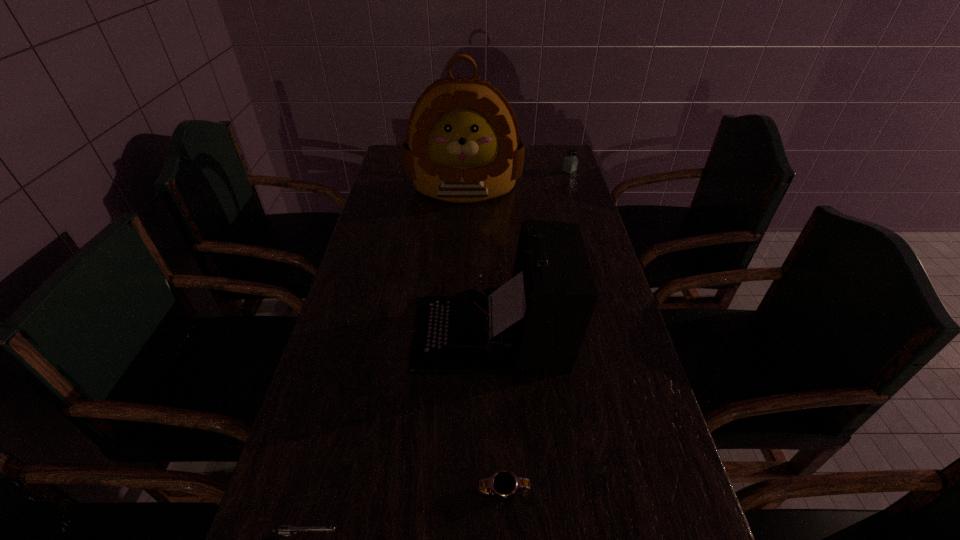
In the image, there is a desktop. Identify the location of free region at the right edge. This screenshot has width=960, height=540. (639, 400).

Where is `free space between the backpack and the fourth shortest object`? The width and height of the screenshot is (960, 540). free space between the backpack and the fourth shortest object is located at coordinates (478, 260).

This screenshot has width=960, height=540. Find the location of `free area in between the shortest object and the typewriter`. free area in between the shortest object and the typewriter is located at coordinates (498, 412).

Find the location of a particular element. This screenshot has height=540, width=960. unoccupied position between the saltshaker and the tallest object is located at coordinates (516, 179).

At what (x,y) coordinates should I click in order to perform the action: click on the second closest object to the nearest object. Please return your answer as a coordinate pair (x, y). The image size is (960, 540). Looking at the image, I should click on coord(537,321).

Locate which object ranks second in proximity to the watch. Please provide its 2D coordinates. Your answer should be formatted as a tuple, i.e. [(x, y)], where the tuple contains the x and y coordinates of a point satisfying the conditions above.

[(284, 530)]

This screenshot has width=960, height=540. Identify the location of vacant point that satisfies the following two spatial constraints: 1. on the front-facing side of the backpack; 2. on the right side of the fourth farthest object. (449, 491).

This screenshot has width=960, height=540. Find the location of `vacant position in the image that satisfies the following two spatial constraints: 1. inside the open case of the watch; 2. on the right side of the third farthest object`. vacant position in the image that satisfies the following two spatial constraints: 1. inside the open case of the watch; 2. on the right side of the third farthest object is located at coordinates (496, 491).

In order to click on free spot that satisfies the following two spatial constraints: 1. inside the open case of the shortest object; 2. on the left side of the third farthest object in this screenshot , I will do `click(496, 491)`.

At what (x,y) coordinates should I click in order to perform the action: click on free location that satisfies the following two spatial constraints: 1. inside the open case of the second tallest object; 2. on the right side of the shortest object. Please return your answer as a coordinate pair (x, y). The height and width of the screenshot is (540, 960). Looking at the image, I should click on (496, 491).